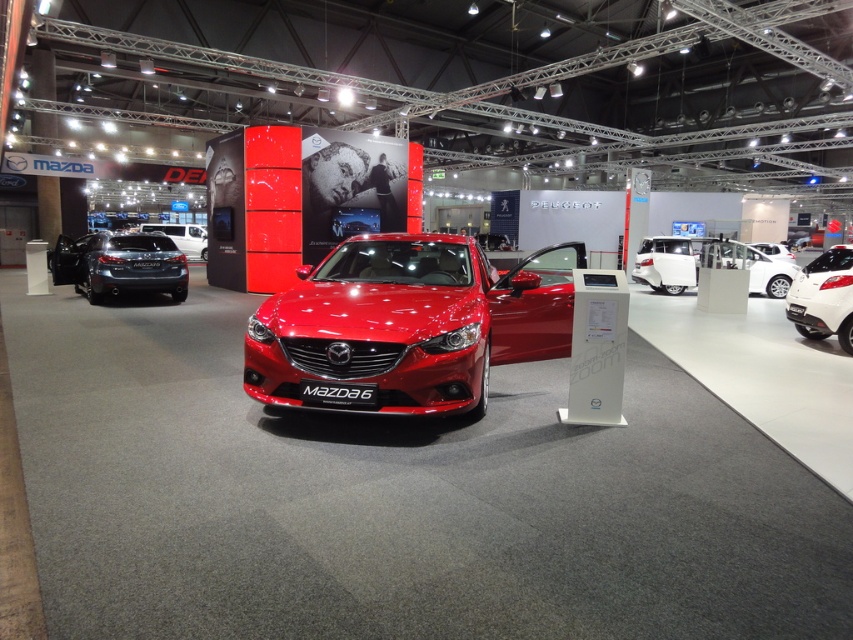
Question: Can you confirm if matte black hatchback at left is bigger than satin silver car at center?

Choices:
 (A) yes
 (B) no

Answer: (B)

Question: Considering the relative positions of glossy red car at center and matte black hatchback at left in the image provided, where is glossy red car at center located with respect to matte black hatchback at left?

Choices:
 (A) below
 (B) above

Answer: (B)

Question: Which of the following is the farthest from the observer?

Choices:
 (A) glossy red car at center
 (B) satin silver car at center
 (C) satin white sedan at center
 (D) matte black hatchback at left

Answer: (C)

Question: Which of the following is the closest to the observer?

Choices:
 (A) (743, 257)
 (B) (831, 289)

Answer: (B)

Question: Which of the following is the farthest from the observer?

Choices:
 (A) white glossy car at right
 (B) satin white sedan at center
 (C) glossy red car at center
 (D) satin silver car at center

Answer: (B)

Question: Is the position of glossy red car at center less distant than that of white glossy car at right?

Choices:
 (A) yes
 (B) no

Answer: (A)